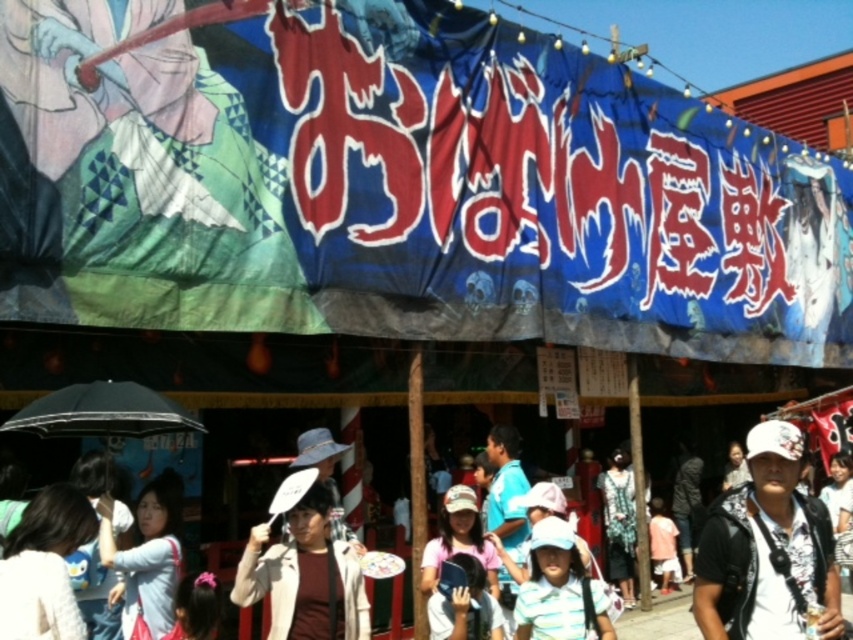
Which is in front, point (300, 557) or point (613, 509)?

Point (300, 557) is in front.

Who is shorter, white matte hat at center or patterned fabric dress at center?

white matte hat at center is shorter.

You are a GUI agent. You are given a task and a screenshot of the screen. Output one action in this format:
    pyautogui.click(x=<x>, y=<y>)
    Task: Click on the white matte hat at center
    The image size is (853, 640).
    Given the screenshot: What is the action you would take?
    pyautogui.click(x=305, y=577)

Which is more to the left, blue fabric banner at upper center or white matte hat at center?

From the viewer's perspective, white matte hat at center appears more on the left side.

Can you confirm if blue fabric banner at upper center is shorter than white matte hat at center?

In fact, blue fabric banner at upper center may be taller than white matte hat at center.

Does point (544, 202) come behind point (323, 490)?

That is True.

What are the coordinates of `blue fabric banner at upper center` in the screenshot? It's located at (402, 188).

Based on the photo, who is lower down, blue fabric banner at upper center or patterned fabric dress at center?

Positioned lower is patterned fabric dress at center.

In the scene shown: Who is positioned more to the right, blue fabric banner at upper center or patterned fabric dress at center?

Positioned to the right is blue fabric banner at upper center.

What are the coordinates of `blue fabric banner at upper center` in the screenshot? It's located at (402, 188).